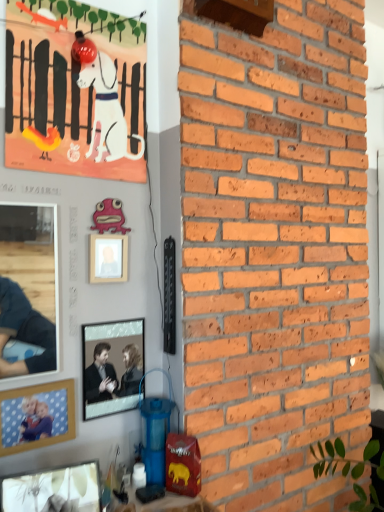
Question: Which is correct: metallic silver picture frame at center, the 2th picture frame in the top-to-bottom sequence, is inside matte glass picture frame at lower left, which ranks as the first picture frame in front-to-back order, or outside of it?

Choices:
 (A) outside
 (B) inside

Answer: (A)

Question: Considering the positions of metallic silver picture frame at center, the 2th picture frame in the top-to-bottom sequence, and matte glass picture frame at lower left, the 1th picture frame when ordered from bottom to top, in the image, is metallic silver picture frame at center, the 2th picture frame in the top-to-bottom sequence, wider or thinner than matte glass picture frame at lower left, the 1th picture frame when ordered from bottom to top,?

Choices:
 (A) thin
 (B) wide

Answer: (A)

Question: Which object is the closest to the metallic silver picture frame at center, which appears as the 2th picture frame when viewed from the back?

Choices:
 (A) pink wood picture frame at upper center, which is the 4th picture frame in front-to-back order
 (B) wooden picture frame at lower left, which is the third picture frame in back-to-front order
 (C) matte glass picture frame at lower left, which is counted as the fourth picture frame, starting from the top
 (D) matte paper poster at upper left

Answer: (B)

Question: Which is nearer to the wooden picture frame at lower left, the third picture frame from the top?

Choices:
 (A) pink wood picture frame at upper center, marked as the 4th picture frame in a bottom-to-top arrangement
 (B) metallic silver picture frame at center, which ranks as the 3th picture frame in front-to-back order
 (C) matte paper poster at upper left
 (D) matte glass picture frame at lower left, which ranks as the first picture frame in front-to-back order

Answer: (B)